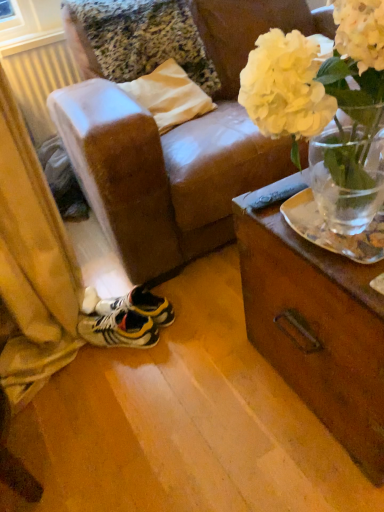
Question: Does white matte vase at upper right have a lesser height compared to yellow and black synthetic sneakers at lower left?

Choices:
 (A) no
 (B) yes

Answer: (A)

Question: Can you confirm if white matte vase at upper right is positioned to the right of yellow and black synthetic sneakers at lower left?

Choices:
 (A) yes
 (B) no

Answer: (A)

Question: Considering the relative sizes of white matte vase at upper right and yellow and black synthetic sneakers at lower left in the image provided, is white matte vase at upper right thinner than yellow and black synthetic sneakers at lower left?

Choices:
 (A) yes
 (B) no

Answer: (B)

Question: Considering the relative sizes of white matte vase at upper right and yellow and black synthetic sneakers at lower left in the image provided, is white matte vase at upper right bigger than yellow and black synthetic sneakers at lower left?

Choices:
 (A) no
 (B) yes

Answer: (B)

Question: From the image's perspective, is white matte vase at upper right under yellow and black synthetic sneakers at lower left?

Choices:
 (A) no
 (B) yes

Answer: (A)

Question: In terms of height, does yellow and black synthetic sneakers at lower left look taller or shorter compared to white plastic radiator at left?

Choices:
 (A) short
 (B) tall

Answer: (A)

Question: Is yellow and black synthetic sneakers at lower left wider or thinner than white plastic radiator at left?

Choices:
 (A) wide
 (B) thin

Answer: (A)

Question: In the image, is yellow and black synthetic sneakers at lower left on the left side or the right side of white plastic radiator at left?

Choices:
 (A) left
 (B) right

Answer: (B)

Question: Considering their positions, is yellow and black synthetic sneakers at lower left located in front of or behind white plastic radiator at left?

Choices:
 (A) behind
 (B) front

Answer: (B)

Question: Is white plastic radiator at left bigger or smaller than yellow and black synthetic sneakers at lower left?

Choices:
 (A) big
 (B) small

Answer: (A)

Question: Would you say white plastic radiator at left is to the left or to the right of yellow and black synthetic sneakers at lower left in the picture?

Choices:
 (A) left
 (B) right

Answer: (A)

Question: Considering the positions of white plastic radiator at left and yellow and black synthetic sneakers at lower left in the image, is white plastic radiator at left taller or shorter than yellow and black synthetic sneakers at lower left?

Choices:
 (A) tall
 (B) short

Answer: (A)

Question: From a real-world perspective, is white plastic radiator at left above or below yellow and black synthetic sneakers at lower left?

Choices:
 (A) below
 (B) above

Answer: (B)

Question: Is yellow and black synthetic sneakers at lower left in front of or behind white matte vase at upper right in the image?

Choices:
 (A) behind
 (B) front

Answer: (A)

Question: From the image's perspective, is yellow and black synthetic sneakers at lower left above or below white matte vase at upper right?

Choices:
 (A) below
 (B) above

Answer: (A)